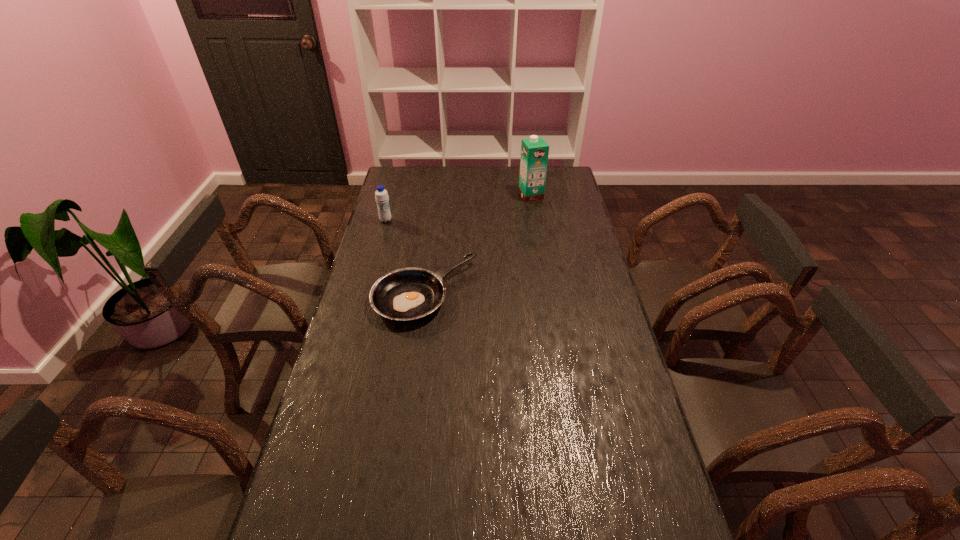
In order to click on water bottle that is at the left edge in this screenshot , I will do `click(381, 195)`.

The height and width of the screenshot is (540, 960). In order to click on frying pan present at the left edge in this screenshot , I will do `click(406, 294)`.

Find the location of a particular element. Image resolution: width=960 pixels, height=540 pixels. object positioned at the right edge is located at coordinates (534, 151).

At what (x,y) coordinates should I click in order to perform the action: click on object at the far right corner. Please return your answer as a coordinate pair (x, y). This screenshot has width=960, height=540. Looking at the image, I should click on (534, 151).

In the image, there is a desktop. In order to click on vacant space at the far edge in this screenshot , I will do `click(510, 177)`.

Find the location of `vacant space at the left edge of the desktop`. vacant space at the left edge of the desktop is located at coordinates (373, 411).

In the image, there is a desktop. Where is `vacant space at the right edge`? vacant space at the right edge is located at coordinates (572, 276).

In order to click on free area in between the farthest object and the shortest object in this screenshot , I will do `click(478, 244)`.

Identify the location of vacant space that is in between the rightmost object and the water bottle. Image resolution: width=960 pixels, height=540 pixels. (458, 208).

Where is `vacant space that's between the nearest object and the second nearest object`? vacant space that's between the nearest object and the second nearest object is located at coordinates (405, 256).